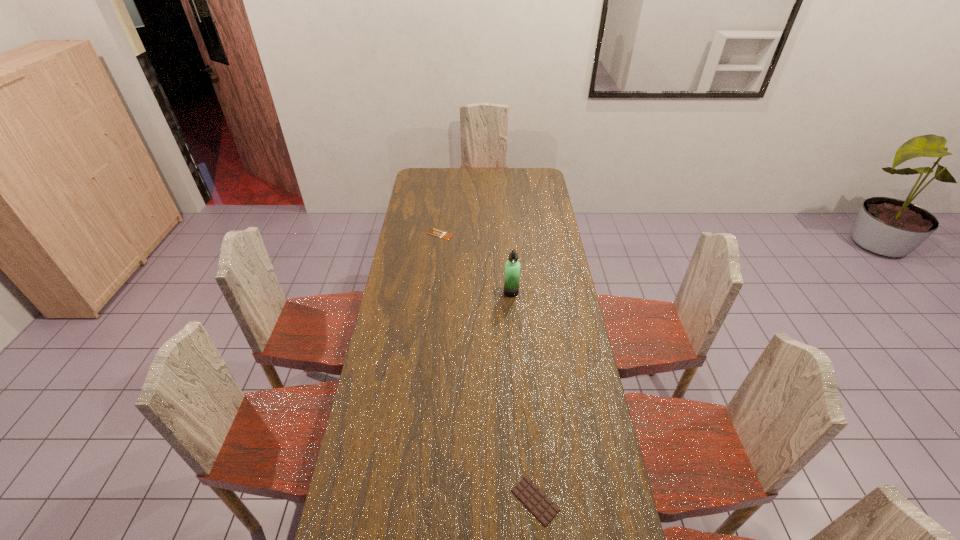
Find the location of a particular element. the tallest object is located at coordinates (512, 267).

The width and height of the screenshot is (960, 540). What are the coordinates of `thermos bottle` in the screenshot? It's located at (512, 267).

Identify the location of the second shortest object. The width and height of the screenshot is (960, 540). (532, 497).

At what (x,y) coordinates should I click in order to perform the action: click on the right chocolate bar. Please return your answer as a coordinate pair (x, y). The height and width of the screenshot is (540, 960). Looking at the image, I should click on (532, 497).

This screenshot has height=540, width=960. I want to click on the shortest object, so click(x=435, y=232).

I want to click on the shorter chocolate bar, so click(435, 232).

The height and width of the screenshot is (540, 960). Find the location of `free space located 0.320m on the front of the second farthest object`. free space located 0.320m on the front of the second farthest object is located at coordinates (516, 357).

The height and width of the screenshot is (540, 960). I want to click on vacant space located on the back of the taller chocolate bar, so click(530, 435).

In order to click on free space located 0.260m on the right of the leftmost object in this screenshot , I will do `click(506, 234)`.

Locate an element on the screen. Image resolution: width=960 pixels, height=540 pixels. object situated at the left edge is located at coordinates (435, 232).